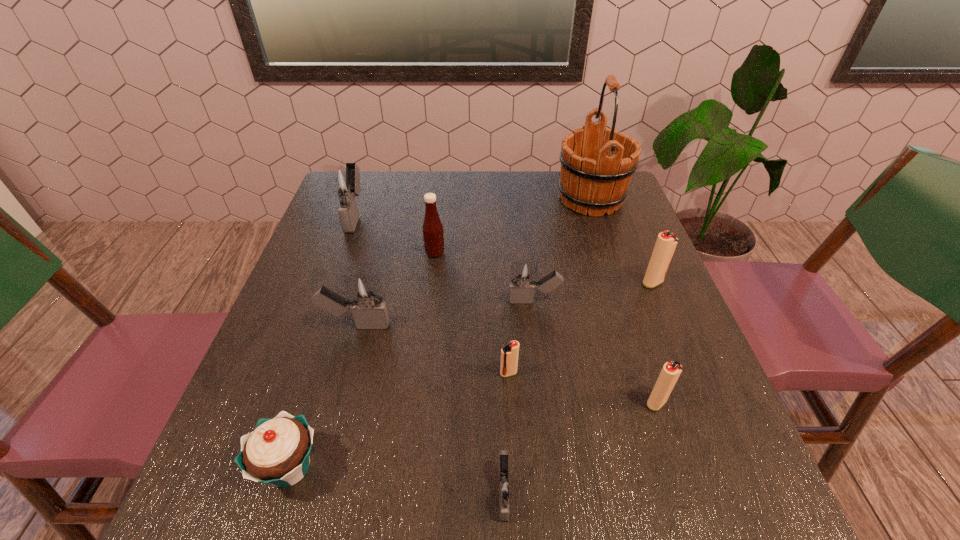
In order to click on unoccupied position between the white Tabasco sauce and the fourth farthest igniter in this screenshot , I will do `click(396, 289)`.

Locate an element on the screen. This screenshot has height=540, width=960. vacant area that lies between the smallest gray igniter and the wine bucket is located at coordinates (547, 346).

Locate an element on the screen. The width and height of the screenshot is (960, 540). the seventh closest object to the white Tabasco sauce is located at coordinates (278, 450).

Locate which object is the ninth closest to the second gray igniter from right to left. Please provide its 2D coordinates. Your answer should be formatted as a tuple, i.e. [(x, y)], where the tuple contains the x and y coordinates of a point satisfying the conditions above.

[(342, 181)]

Point out which igniter is positioned as the nearest to the sixth nearest object. Please provide its 2D coordinates. Your answer should be formatted as a tuple, i.e. [(x, y)], where the tuple contains the x and y coordinates of a point satisfying the conditions above.

[(509, 354)]

Where is `igniter that is the fifth nearest to the second igniter from right to left`? This screenshot has width=960, height=540. igniter that is the fifth nearest to the second igniter from right to left is located at coordinates (365, 299).

This screenshot has width=960, height=540. I want to click on gray igniter that is the third closest to the second farthest red igniter, so click(365, 299).

Point out which gray igniter is positioned as the second nearest to the white Tabasco sauce. Please provide its 2D coordinates. Your answer should be formatted as a tuple, i.e. [(x, y)], where the tuple contains the x and y coordinates of a point satisfying the conditions above.

[(365, 299)]

Identify the location of red igniter object that ranks as the second closest to the wine bucket. (509, 354).

Locate an element on the screen. the second closest red igniter to the Tabasco sauce is located at coordinates (666, 242).